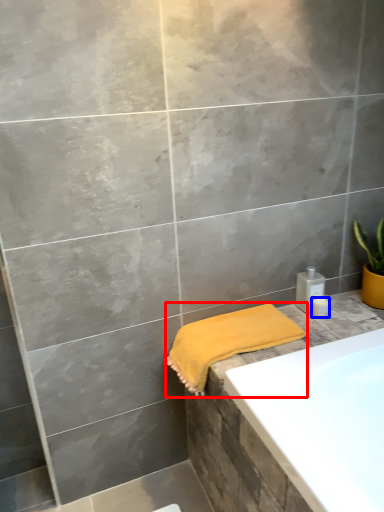
Question: Which point is further to the camera, towel (highlighted by a red box) or toiletry (highlighted by a blue box)?

Choices:
 (A) towel
 (B) toiletry

Answer: (B)